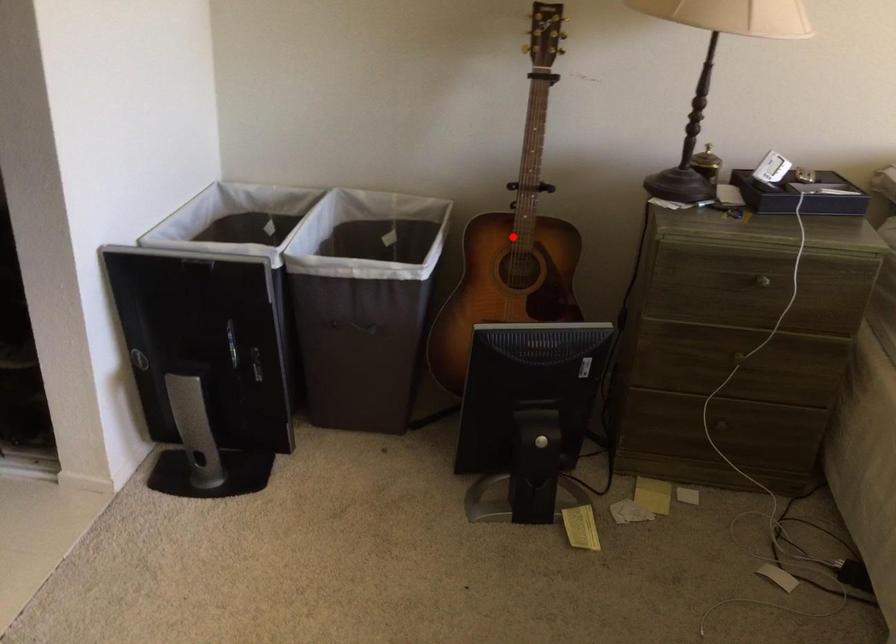
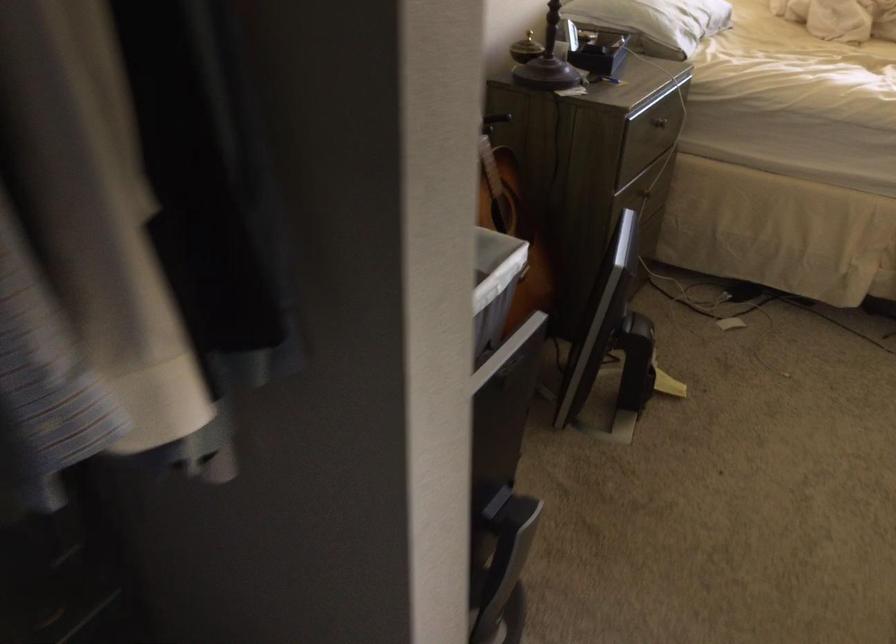
Question: I am providing you with two images of the same scene from different viewpoints. A red point is marked on the first image. Can you still see the location of the red point in image 2?

Choices:
 (A) Yes
 (B) No

Answer: (B)